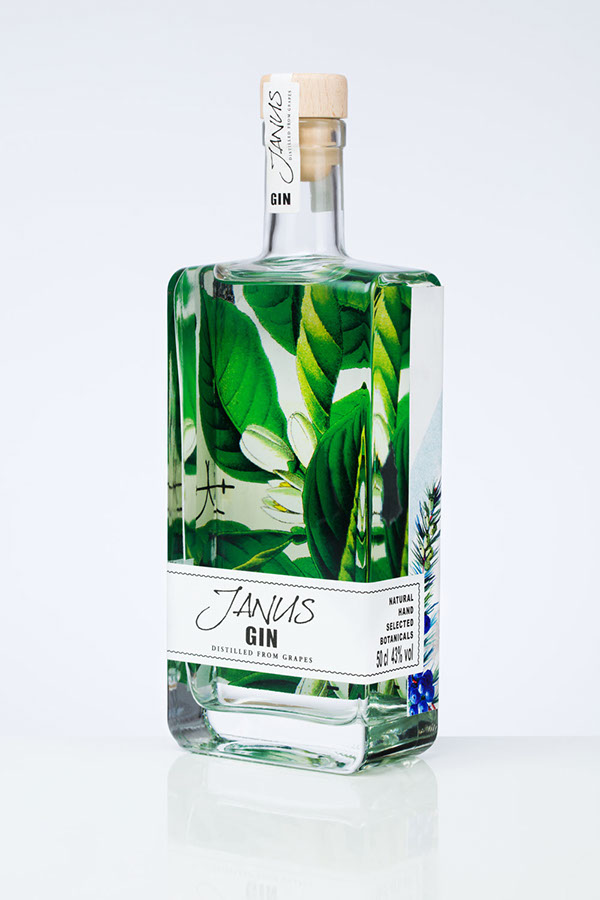
The height and width of the screenshot is (900, 600). I want to click on reflection of glass bottle on tabletop, so click(x=184, y=784), click(x=394, y=831), click(x=273, y=829).